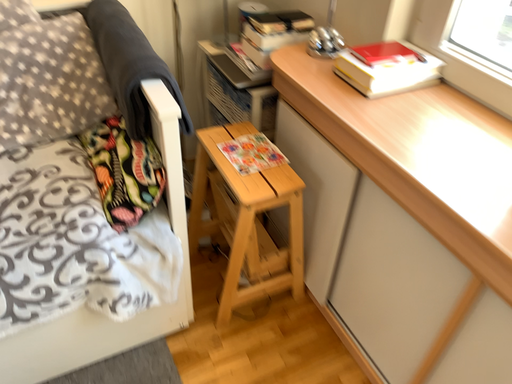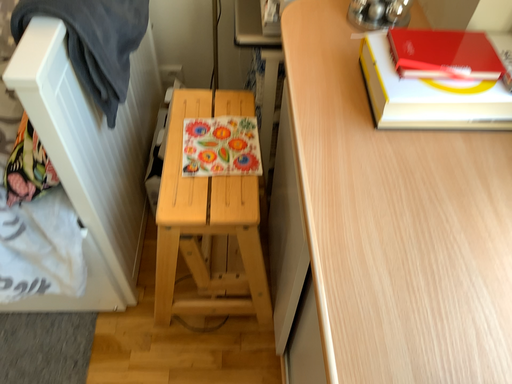
Question: How did the camera likely rotate when shooting the video?

Choices:
 (A) rotated right
 (B) rotated left

Answer: (B)